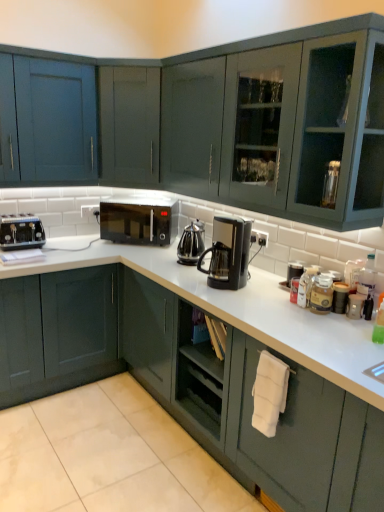
You are a GUI agent. You are given a task and a screenshot of the screen. Output one action in this format:
    pyautogui.click(x=<x>, y=<y>)
    Task: Click on the vacant space situated on the left part of metallic silver canister at right
    The width and height of the screenshot is (384, 512).
    Given the screenshot: What is the action you would take?
    pyautogui.click(x=331, y=320)